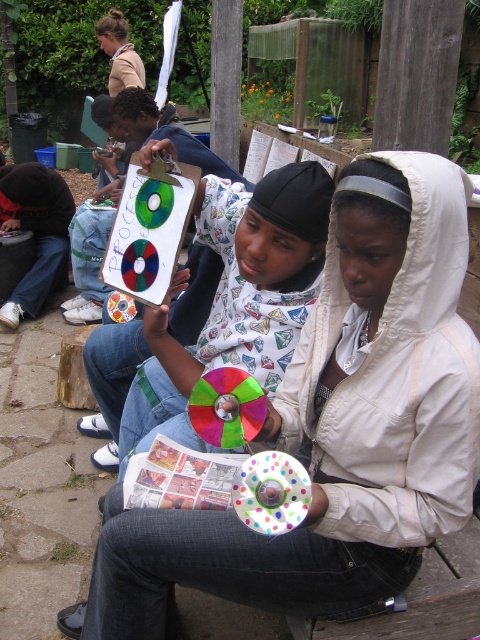
Who is higher up, white matte hoodie at center or matte plastic cd at center?

matte plastic cd at center is higher up.

Is point (188, 540) less distant than point (303, 291)?

That is True.

Which is behind, point (228, 532) or point (148, 413)?

The point (148, 413) is more distant.

At what (x,y) coordinates should I click in order to perform the action: click on white matte hoodie at center. Please return your answer as a coordinate pair (x, y). The image size is (480, 640). Looking at the image, I should click on (336, 426).

Which is behind, point (332, 518) or point (107, 28)?

Positioned behind is point (107, 28).

Which is above, white matte hoodie at center or light brown leather jacket at upper left?

light brown leather jacket at upper left

Is point (412, 554) more distant than point (127, 61)?

No, (412, 554) is closer to viewer.

This screenshot has height=640, width=480. What are the coordinates of `white matte hoodie at center` in the screenshot? It's located at (336, 426).

Looking at this image, is matte plastic cd at center thinner than light brown leather jacket at upper left?

No, matte plastic cd at center is not thinner than light brown leather jacket at upper left.

Is matte plastic cd at center taller than light brown leather jacket at upper left?

No.

The image size is (480, 640). Identify the location of matte plastic cd at center. (230, 301).

At what (x,y) coordinates should I click in order to perform the action: click on matte plastic cd at center. Please return your answer as a coordinate pair (x, y). Looking at the image, I should click on (230, 301).